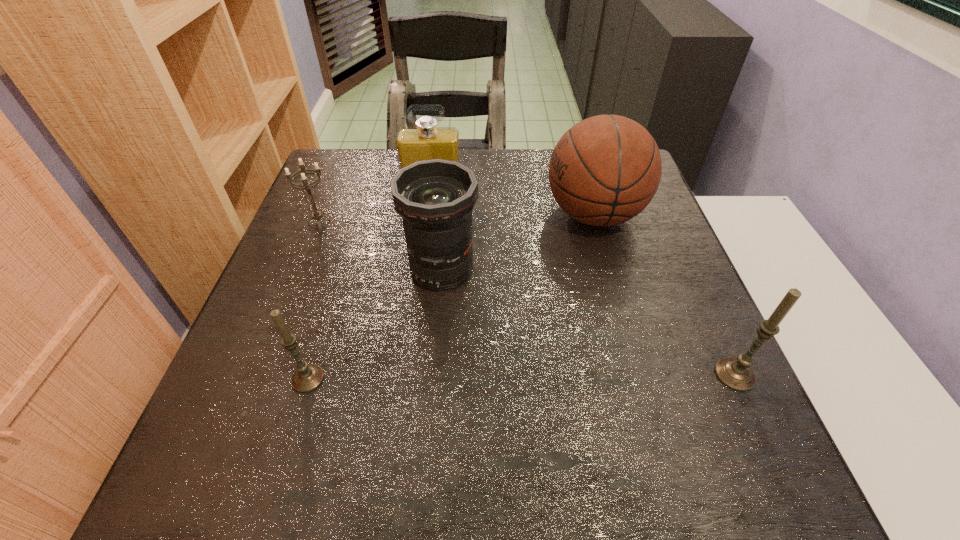
Where is `candle holder present at the left edge`? candle holder present at the left edge is located at coordinates (317, 215).

Where is `candle that is positioned at the right edge`? Image resolution: width=960 pixels, height=540 pixels. candle that is positioned at the right edge is located at coordinates (736, 374).

Image resolution: width=960 pixels, height=540 pixels. I want to click on basketball that is at the right edge, so click(606, 169).

The image size is (960, 540). Find the location of `object at the near left corner`. object at the near left corner is located at coordinates (x=307, y=377).

Locate an element on the screen. This screenshot has height=540, width=960. object present at the far right corner is located at coordinates (606, 169).

This screenshot has height=540, width=960. Identify the location of object that is positioned at the near right corner. (736, 374).

Identify the location of vacant region at the far edge of the desktop. (550, 154).

Find the location of a particular element. This screenshot has height=540, width=960. free space at the near edge of the desktop is located at coordinates (514, 396).

The width and height of the screenshot is (960, 540). What are the coordinates of `vacant area at the left edge` in the screenshot? It's located at (314, 310).

Image resolution: width=960 pixels, height=540 pixels. Find the location of `vacant space at the right edge of the desktop`. vacant space at the right edge of the desktop is located at coordinates (639, 338).